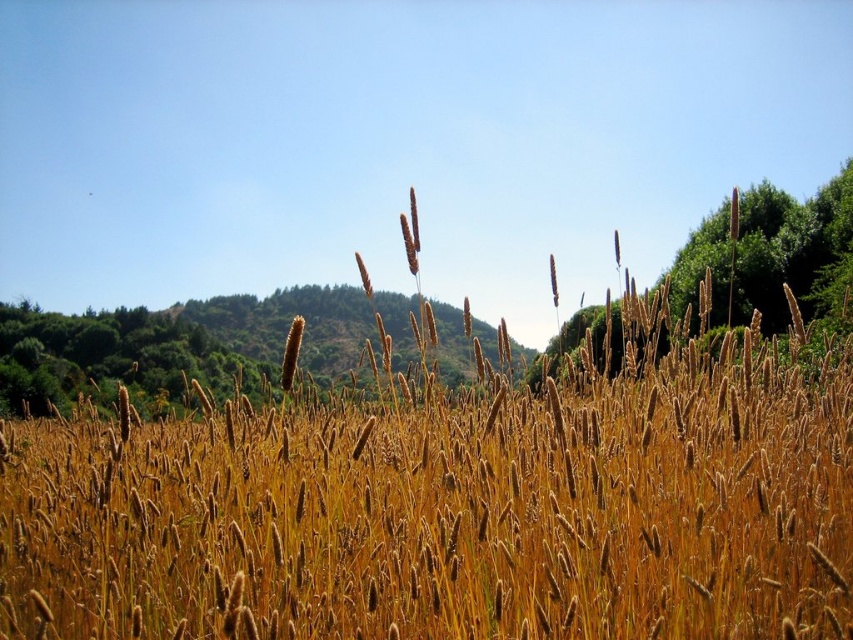
You are standing in the countryside and see the golden matte wheat field at center and the green leafy tree at upper right. Which object is positioned higher in the image?

The green leafy tree at upper right is positioned higher in the image than the golden matte wheat field at center.

You are an artist planning to paint the scene. You want to ensure the golden matte wheat field at center and the green leafy tree at upper right are proportionally accurate. Which object should you make smaller in your painting to maintain the correct proportions?

The golden matte wheat field at center occupies less space than the green leafy tree at upper right, so you should make the golden matte wheat field at center smaller in your painting to maintain the correct proportions.